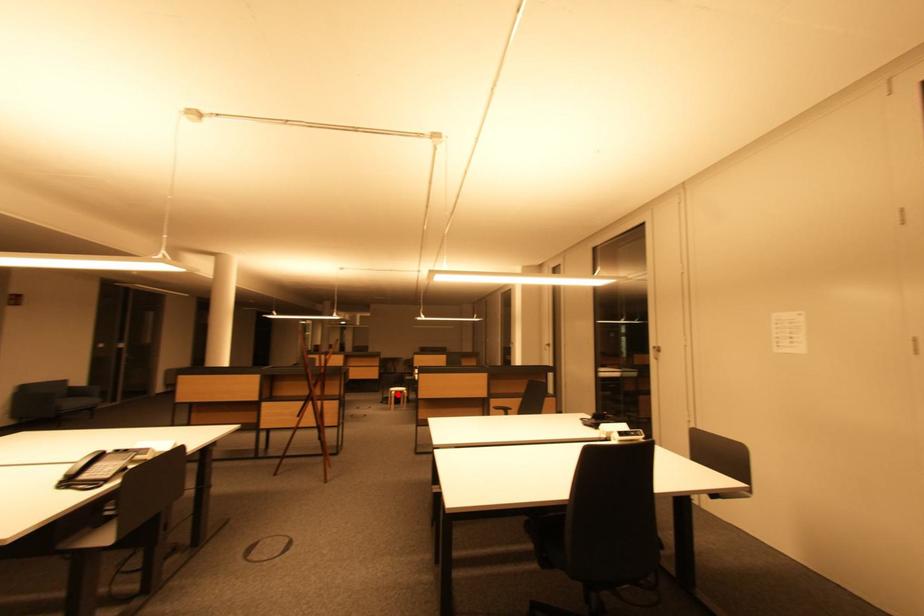
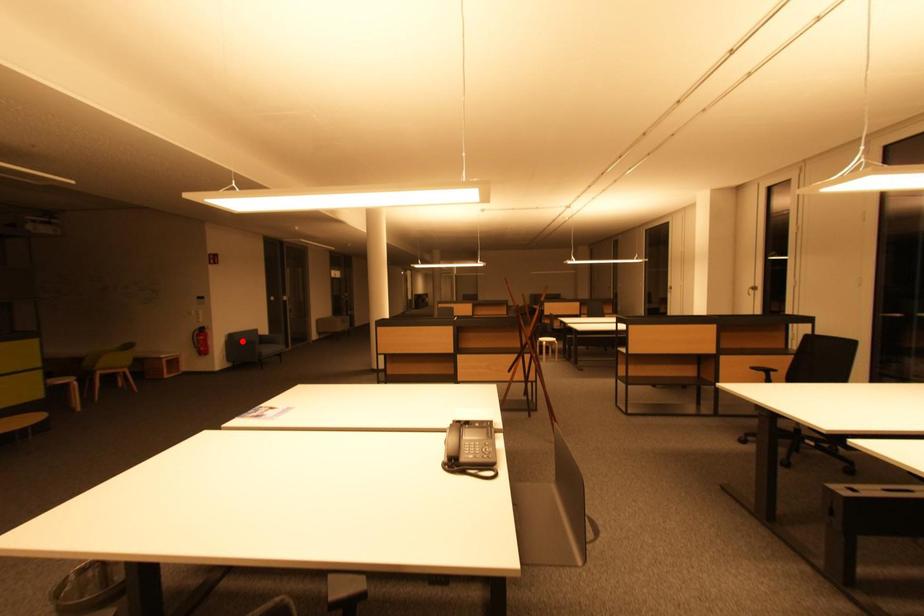
I am providing you with two images of the same scene from different viewpoints. A red point is marked on the first image and another point is marked on the second image. Is the red point in image1 aligned with the point shown in image2?

No